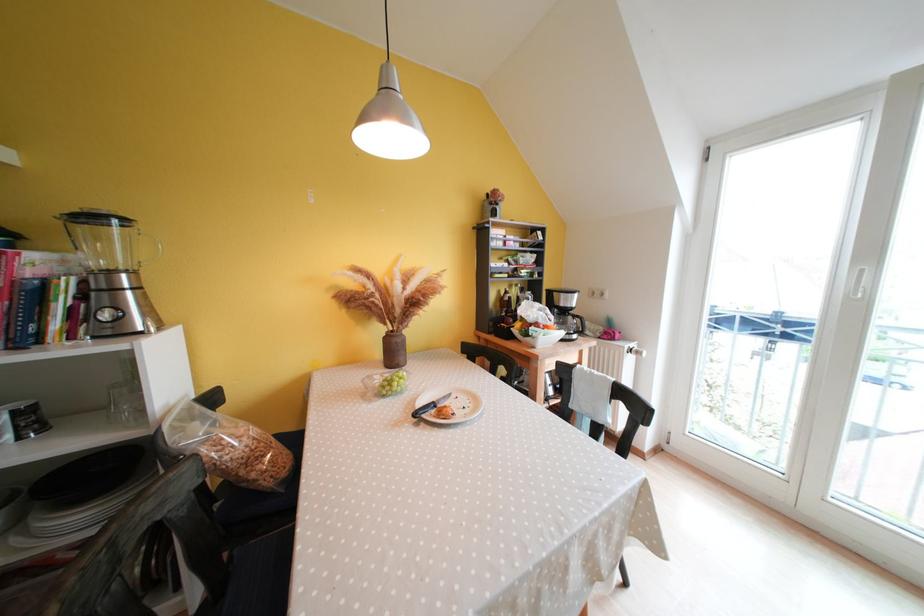
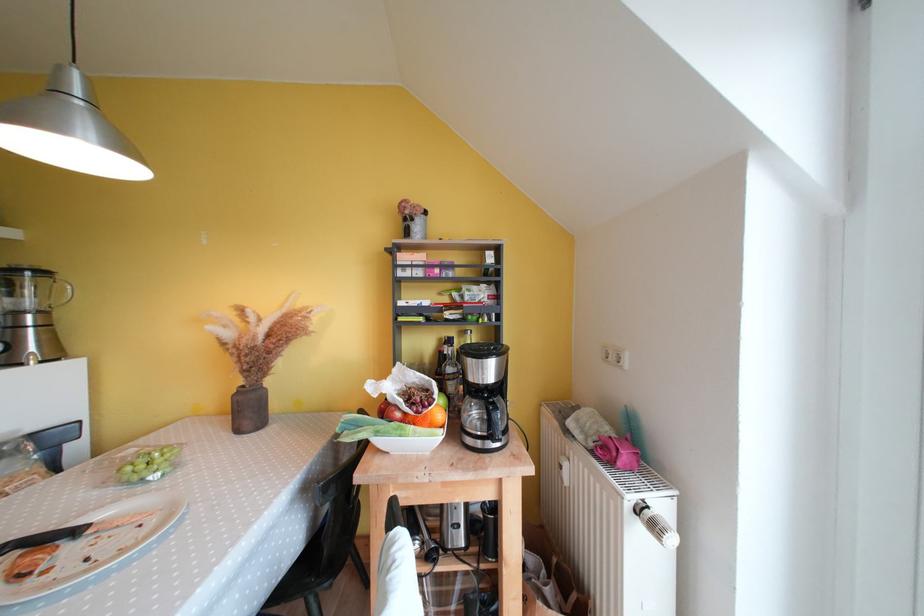
The point at (140, 276) is marked in the first image. Where is the corresponding point in the second image?

(49, 315)